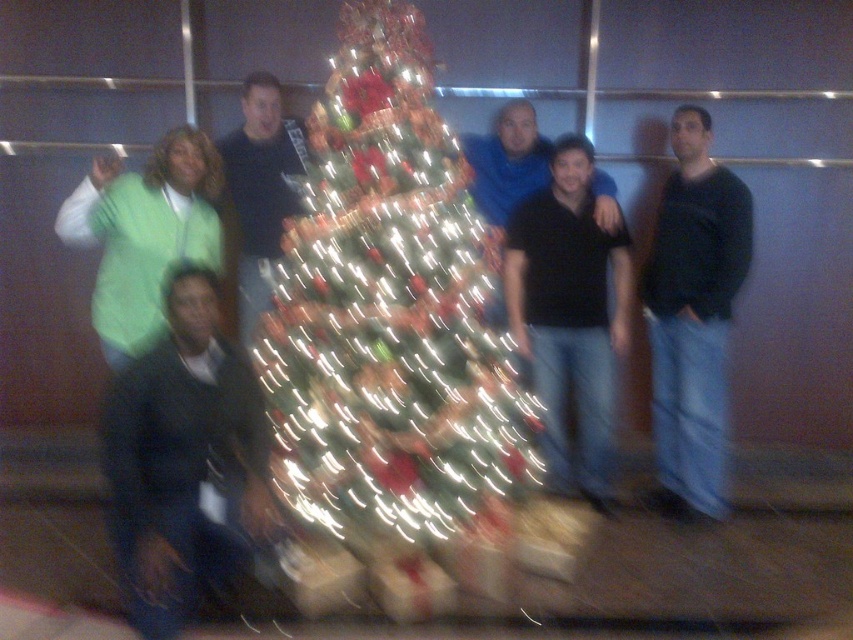
Is green matte christmas tree at center bigger than green fleece at left?

Yes, green matte christmas tree at center is bigger than green fleece at left.

What do you see at coordinates (389, 337) in the screenshot? I see `green matte christmas tree at center` at bounding box center [389, 337].

You are a GUI agent. You are given a task and a screenshot of the screen. Output one action in this format:
    pyautogui.click(x=<x>, y=<y>)
    Task: Click on the green matte christmas tree at center
    The height and width of the screenshot is (640, 853).
    Given the screenshot: What is the action you would take?
    pyautogui.click(x=389, y=337)

Between black matte shirt at center and matte black shirt at center, which one has less height?

matte black shirt at center

In order to click on black matte shirt at center in this screenshot , I will do `click(569, 314)`.

Find the location of `black matte shirt at center`. black matte shirt at center is located at coordinates (569, 314).

Does dark blue jacket at lower left appear over matte black shirt at center?

No.

Is point (235, 365) farther from camera compared to point (228, 134)?

No.

This screenshot has height=640, width=853. Describe the element at coordinates (183, 460) in the screenshot. I see `dark blue jacket at lower left` at that location.

Find the location of `dark blue jacket at lower left`. dark blue jacket at lower left is located at coordinates (183, 460).